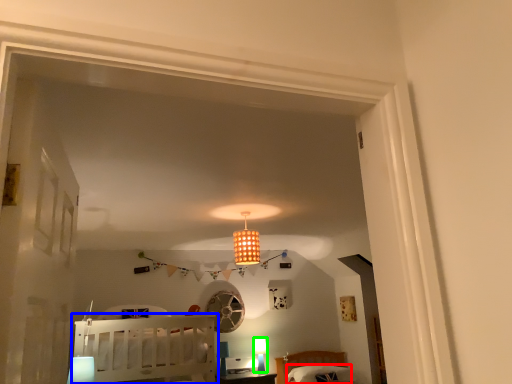
Question: Which object is positioned farthest from pillow (highlighted by a red box)? Select from furniture (highlighted by a blue box) and lamp (highlighted by a green box).

Choices:
 (A) furniture
 (B) lamp

Answer: (A)